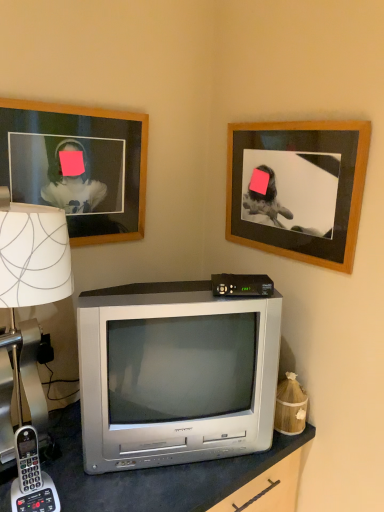
In order to click on white paper lampshade at left in this screenshot , I will do `click(29, 305)`.

What do you see at coordinates (298, 188) in the screenshot? This screenshot has width=384, height=512. I see `wooden frame at upper right, the 1th picture frame positioned from the right` at bounding box center [298, 188].

Describe the element at coordinates (78, 166) in the screenshot. The height and width of the screenshot is (512, 384). I see `wooden framed photo at upper left, arranged as the 1th picture frame when viewed from the left` at that location.

Describe the element at coordinates (31, 477) in the screenshot. I see `gray plastic phone at lower left` at that location.

The height and width of the screenshot is (512, 384). I want to click on black plastic/cable box at center, so click(x=242, y=285).

You are a GUI agent. You are given a task and a screenshot of the screen. Output one action in this format:
    pyautogui.click(x=<x>, y=<y>)
    Task: Click on the white paper lampshade at left
    
    Given the screenshot: What is the action you would take?
    pyautogui.click(x=29, y=305)

Does white paper lampshade at left have a greater width compared to gray plastic phone at lower left?

Correct, the width of white paper lampshade at left exceeds that of gray plastic phone at lower left.

Identify the location of corded phone below the white paper lampshade at left (from a real-world perspective). This screenshot has width=384, height=512. (31, 477).

Can you see white paper lampshade at left touching gray plastic phone at lower left?

No, white paper lampshade at left is not with gray plastic phone at lower left.

Does white paper lampshade at left contain gray plastic phone at lower left?

Absolutely, gray plastic phone at lower left is inside white paper lampshade at left.

Is black plastic/cable box at center to the left of wooden frame at upper right, placed as the second picture frame when sorted from left to right, from the viewer's perspective?

Correct, you'll find black plastic/cable box at center to the left of wooden frame at upper right, placed as the second picture frame when sorted from left to right.

From the image's perspective, which is below, black plastic/cable box at center or wooden frame at upper right, placed as the second picture frame when sorted from left to right?

black plastic/cable box at center appears lower in the image.

How different are the orientations of black plastic/cable box at center and wooden frame at upper right, the 1th picture frame positioned from the right, in degrees?

The angle between the facing direction of black plastic/cable box at center and the facing direction of wooden frame at upper right, the 1th picture frame positioned from the right, is 63.3 degrees.

Is black plastic/cable box at center directly adjacent to wooden frame at upper right, placed as the second picture frame when sorted from left to right?

No, black plastic/cable box at center is not with wooden frame at upper right, placed as the second picture frame when sorted from left to right.

Is black plastic/cable box at center positioned behind gray plastic phone at lower left?

Yes, black plastic/cable box at center is behind gray plastic phone at lower left.

Is black plastic/cable box at center not inside gray plastic phone at lower left?

Yes.

From a real-world perspective, is black plastic/cable box at center physically located above or below gray plastic phone at lower left?

Clearly, from a real-world perspective, black plastic/cable box at center is above gray plastic phone at lower left.

Visually, is gray plastic phone at lower left positioned to the left or to the right of wooden frame at upper right, placed as the second picture frame when sorted from left to right?

In the image, gray plastic phone at lower left appears on the left side of wooden frame at upper right, placed as the second picture frame when sorted from left to right.

Is there a large distance between gray plastic phone at lower left and wooden frame at upper right, placed as the second picture frame when sorted from left to right?

Yes.

Is gray plastic phone at lower left closer to camera compared to wooden frame at upper right, the 1th picture frame positioned from the right?

Yes, the depth of gray plastic phone at lower left is less than that of wooden frame at upper right, the 1th picture frame positioned from the right.

From a real-world perspective, which object stands above the other?

black plastic/cable box at center.

What's the angular difference between black plastic/cable box at center and silver metallic television at center's facing directions?

0.221 degrees separate the facing orientations of black plastic/cable box at center and silver metallic television at center.

Considering the sizes of objects black plastic/cable box at center and silver metallic television at center in the image provided, who is bigger, black plastic/cable box at center or silver metallic television at center?

Bigger between the two is silver metallic television at center.

From the image's perspective, relative to white paper lampshade at left, is wooden frame at upper right, the 1th picture frame positioned from the right, above or below?

Based on their image positions, wooden frame at upper right, the 1th picture frame positioned from the right, is located above white paper lampshade at left.

Which object is positioned more to the right, wooden frame at upper right, the 1th picture frame positioned from the right, or white paper lampshade at left?

wooden frame at upper right, the 1th picture frame positioned from the right.

Which point is more distant from viewer, (241, 156) or (12, 231)?

The point (241, 156) is behind.

Who is smaller, wooden frame at upper right, placed as the second picture frame when sorted from left to right, or white paper lampshade at left?

wooden frame at upper right, placed as the second picture frame when sorted from left to right.

Is wooden framed photo at upper left, arranged as the 1th picture frame when viewed from the left, spatially inside gray plastic phone at lower left, or outside of it?

wooden framed photo at upper left, arranged as the 1th picture frame when viewed from the left, cannot be found inside gray plastic phone at lower left.

From the image's perspective, is wooden framed photo at upper left, arranged as the 1th picture frame when viewed from the left, located above or below gray plastic phone at lower left?

From the image's perspective, wooden framed photo at upper left, arranged as the 1th picture frame when viewed from the left, appears above gray plastic phone at lower left.

From a real-world perspective, count 2nd picture frames upward from the gray plastic phone at lower left and point to it. Please provide its 2D coordinates.

[(78, 166)]

The height and width of the screenshot is (512, 384). Find the location of `lamp located on the left of gray plastic phone at lower left`. lamp located on the left of gray plastic phone at lower left is located at coordinates (29, 305).

What are the coordinates of `gadget that appears below the wooden frame at upper right, placed as the second picture frame when sorted from left to right (from a real-world perspective)` in the screenshot? It's located at (242, 285).

Based on their spatial positions, is silver metallic television at center or gray plastic phone at lower left closer to wooden framed photo at upper left, which is the second picture frame in right-to-left order?

Based on the image, silver metallic television at center appears to be nearer to wooden framed photo at upper left, which is the second picture frame in right-to-left order.

Estimate the real-world distances between objects in this image. Which object is closer to wooden frame at upper right, the 1th picture frame positioned from the right, gray plastic phone at lower left or white paper lampshade at left?

Based on the image, white paper lampshade at left appears to be nearer to wooden frame at upper right, the 1th picture frame positioned from the right.

Looking at the image, which one is located closer to wooden frame at upper right, the 1th picture frame positioned from the right, black plastic/cable box at center or gray plastic phone at lower left?

Based on the image, black plastic/cable box at center appears to be nearer to wooden frame at upper right, the 1th picture frame positioned from the right.

From the image, which object appears to be nearer to black plastic/cable box at center, silver metallic television at center or wooden framed photo at upper left, which is the second picture frame in right-to-left order?

Based on the image, silver metallic television at center appears to be nearer to black plastic/cable box at center.

Looking at the image, which one is located further to silver metallic television at center, gray plastic phone at lower left or wooden framed photo at upper left, arranged as the 1th picture frame when viewed from the left?

Among the two, wooden framed photo at upper left, arranged as the 1th picture frame when viewed from the left, is located further to silver metallic television at center.

When comparing their distances from gray plastic phone at lower left, does wooden frame at upper right, the 1th picture frame positioned from the right, or silver metallic television at center seem further?

The object further to gray plastic phone at lower left is wooden frame at upper right, the 1th picture frame positioned from the right.

In the scene shown: Considering their positions, is black plastic/cable box at center positioned further to gray plastic phone at lower left than white paper lampshade at left?

Among the two, black plastic/cable box at center is located further to gray plastic phone at lower left.

Based on their spatial positions, is wooden framed photo at upper left, which is the second picture frame in right-to-left order, or white paper lampshade at left closer to wooden frame at upper right, the 1th picture frame positioned from the right?

wooden framed photo at upper left, which is the second picture frame in right-to-left order, lies closer to wooden frame at upper right, the 1th picture frame positioned from the right, than the other object.

At what (x,y) coordinates should I click in order to perform the action: click on television situated between wooden framed photo at upper left, arranged as the 1th picture frame when viewed from the left, and wooden frame at upper right, placed as the second picture frame when sorted from left to right, from left to right. Please return your answer as a coordinate pair (x, y). This screenshot has height=512, width=384. Looking at the image, I should click on (175, 374).

Image resolution: width=384 pixels, height=512 pixels. I want to click on television between white paper lampshade at left and black plastic/cable box at center, so click(175, 374).

Image resolution: width=384 pixels, height=512 pixels. What are the coordinates of `corded phone situated between white paper lampshade at left and silver metallic television at center from left to right` in the screenshot? It's located at (31, 477).

This screenshot has height=512, width=384. I want to click on television situated between gray plastic phone at lower left and black plastic/cable box at center from left to right, so click(x=175, y=374).